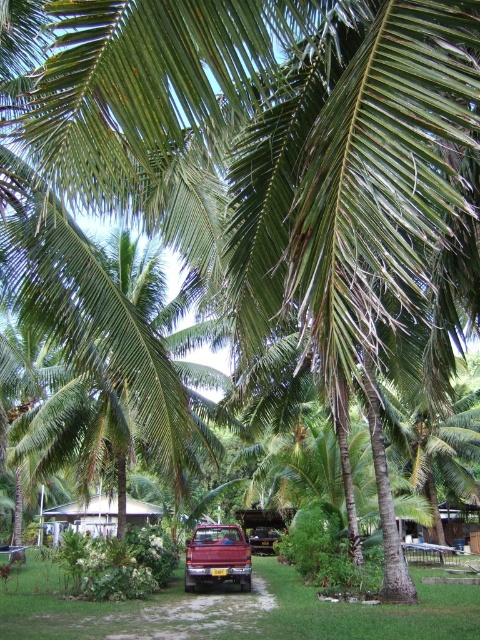
Question: Is shiny red truck at center wider than white corrugated metal hut at center?

Choices:
 (A) no
 (B) yes

Answer: (A)

Question: Among these objects, which one is nearest to the camera?

Choices:
 (A) metallic red car at center
 (B) green leafy palm tree at center

Answer: (B)

Question: Which point is farther from the camera taking this photo?

Choices:
 (A) tap(61, 529)
 (B) tap(273, 532)
 (C) tap(215, 376)
 (D) tap(250, 572)

Answer: (B)

Question: Which object is the closest to the white corrugated metal hut at center?

Choices:
 (A) metallic red car at center
 (B) green leafy palm tree at center
 (C) shiny red truck at center

Answer: (B)

Question: Is shiny red truck at center further to camera compared to metallic red car at center?

Choices:
 (A) yes
 (B) no

Answer: (B)

Question: Where is green leafy palm tree at center located in relation to metallic red car at center in the image?

Choices:
 (A) right
 (B) left

Answer: (B)